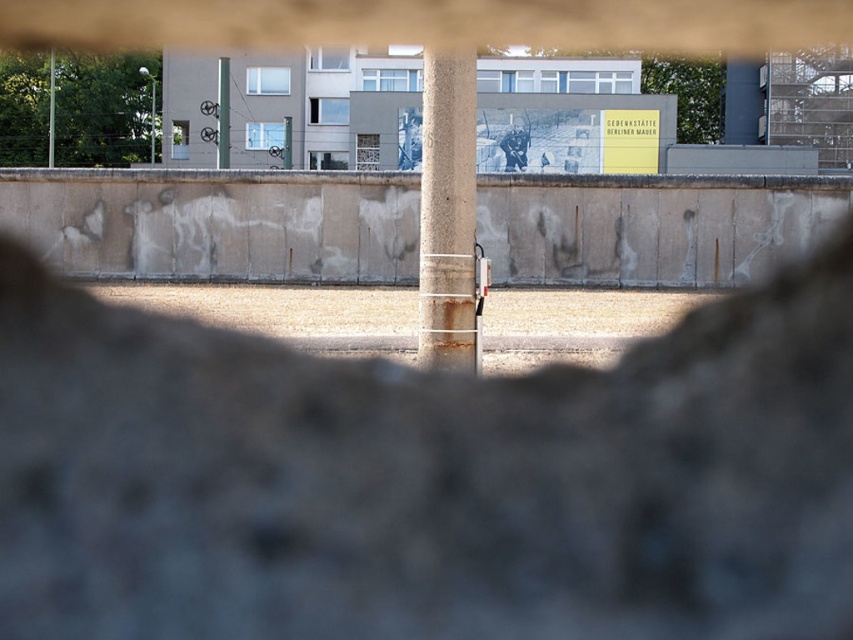
Can you confirm if smooth concrete pillar at center is positioned above green metallic pole at center?

Indeed, smooth concrete pillar at center is positioned over green metallic pole at center.

Is smooth concrete pillar at center shorter than green metallic pole at center?

No, smooth concrete pillar at center is not shorter than green metallic pole at center.

Is point (224, 96) positioned before point (285, 134)?

Yes, it is.

The width and height of the screenshot is (853, 640). Find the location of `smooth concrete pillar at center`. smooth concrete pillar at center is located at coordinates (222, 115).

Does rusty concrete pillar at center have a lesser width compared to smooth concrete pole at center?

Yes.

What do you see at coordinates (447, 211) in the screenshot? The width and height of the screenshot is (853, 640). I see `rusty concrete pillar at center` at bounding box center [447, 211].

Image resolution: width=853 pixels, height=640 pixels. What are the coordinates of `rusty concrete pillar at center` in the screenshot? It's located at (447, 211).

Does point (53, 161) come closer to viewer compared to point (285, 118)?

No, it is behind (285, 118).

Between smooth concrete pole at center and green metallic pole at center, which one is positioned lower?

green metallic pole at center is lower down.

Does point (49, 97) lie behind point (288, 138)?

Yes, it is.

Where is `smooth concrete pole at center`? smooth concrete pole at center is located at coordinates (51, 112).